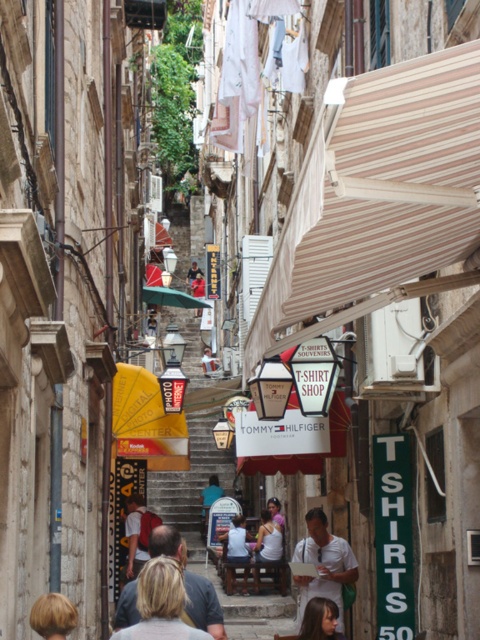
You are a tourist walking down the street and want to grab your belongings. You have a red backpack at center and a white cotton shirt at center. Which one is closer to your right side?

The white cotton shirt at center is closer to your right side because the red backpack at center is to the left of it.

You are a tourist standing on the cobblestone street and see both the red backpack at center and the white cotton tank top at center. Which item is positioned higher relative to the other?

The red backpack at center is located above the white cotton tank top at center, so it is positioned higher.